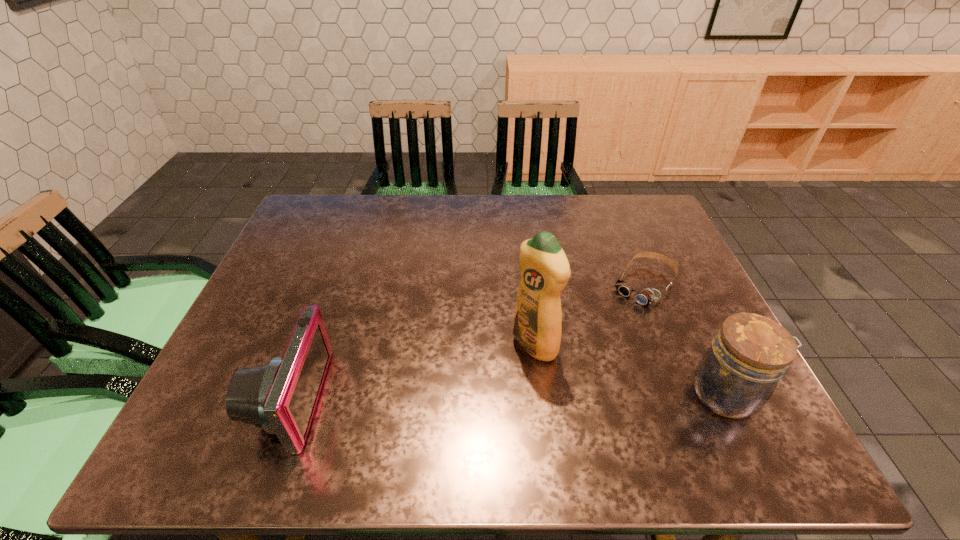
Identify the location of object that is at the near left corner. (x=280, y=396).

Identify the location of object situated at the near right corner. (737, 375).

This screenshot has width=960, height=540. In order to click on free point at the far edge in this screenshot , I will do `click(370, 225)`.

The image size is (960, 540). I want to click on free point at the near edge, so click(x=550, y=396).

Identify the location of vacant space at the left edge of the desktop. This screenshot has width=960, height=540. click(x=243, y=359).

The height and width of the screenshot is (540, 960). I want to click on vacant region at the right edge of the desktop, so click(x=687, y=296).

Where is `free region at the far left corner of the desktop`? free region at the far left corner of the desktop is located at coordinates click(x=305, y=238).

Find the location of a particular element. This screenshot has width=960, height=540. vacant area at the far right corner of the desktop is located at coordinates (639, 212).

Find the location of a particular element. free space between the shortest object and the third tallest object is located at coordinates (468, 342).

Where is `free area in between the shortest object and the tallest object`? free area in between the shortest object and the tallest object is located at coordinates (589, 315).